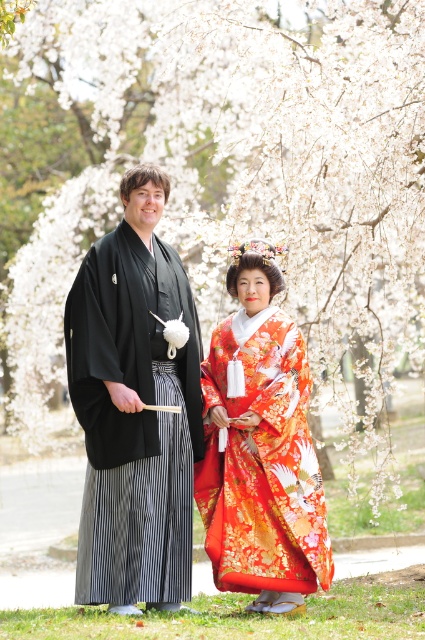
You are a photographer trying to capture the perfect shot of the black silk kimono at center. The camera you are using has a fixed focus point at coordinate point (135, 406). Will the kimono be in focus in your photo?

The black silk kimono at center is located at point (135, 406), so yes, the kimono will be in focus since the camera is focused at that coordinate.

You are a photographer trying to capture both the black silk kimono at center and the silky orange kimono at center in a single frame. Based on their positions, which kimono should you focus on first to ensure both are in the shot?

The black silk kimono at center is positioned on the left side of the silky orange kimono at center, so you should focus on the black silk kimono at center first to ensure both are in the shot.